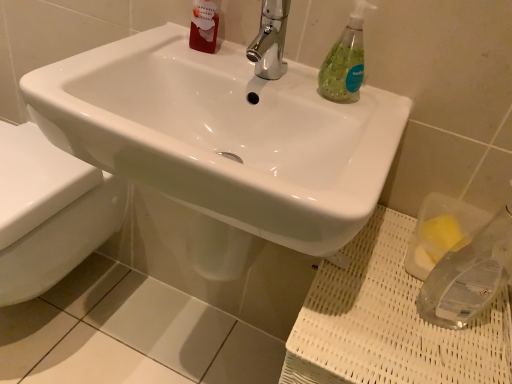
Question: From a real-world perspective, is chrome metallic faucet at upper center positioned over clear plastic sponge at lower right based on gravity?

Choices:
 (A) no
 (B) yes

Answer: (B)

Question: Is chrome metallic faucet at upper center facing towards clear plastic sponge at lower right?

Choices:
 (A) yes
 (B) no

Answer: (B)

Question: Is clear plastic sponge at lower right a part of chrome metallic faucet at upper center?

Choices:
 (A) no
 (B) yes

Answer: (A)

Question: Considering the relative sizes of chrome metallic faucet at upper center and clear plastic sponge at lower right in the image provided, is chrome metallic faucet at upper center shorter than clear plastic sponge at lower right?

Choices:
 (A) no
 (B) yes

Answer: (B)

Question: Is the depth of chrome metallic faucet at upper center less than that of clear plastic sponge at lower right?

Choices:
 (A) yes
 (B) no

Answer: (B)

Question: Considering the positions of point (332, 92) and point (212, 23), is point (332, 92) closer or farther from the camera than point (212, 23)?

Choices:
 (A) closer
 (B) farther

Answer: (A)

Question: From a real-world perspective, is green translucent soap dispenser at upper right physically located above or below translucent red liquid at upper left?

Choices:
 (A) below
 (B) above

Answer: (A)

Question: Is green translucent soap dispenser at upper right taller or shorter than translucent red liquid at upper left?

Choices:
 (A) tall
 (B) short

Answer: (B)

Question: Considering their positions, is green translucent soap dispenser at upper right located in front of or behind translucent red liquid at upper left?

Choices:
 (A) behind
 (B) front

Answer: (B)

Question: Is translucent red liquid at upper left situated inside white glossy toilet at lower left or outside?

Choices:
 (A) inside
 (B) outside

Answer: (B)

Question: Based on their sizes in the image, would you say translucent red liquid at upper left is bigger or smaller than white glossy toilet at lower left?

Choices:
 (A) big
 (B) small

Answer: (B)

Question: Does point (215, 3) appear closer or farther from the camera than point (35, 233)?

Choices:
 (A) closer
 (B) farther

Answer: (A)

Question: From a real-world perspective, is translucent red liquid at upper left above or below white glossy toilet at lower left?

Choices:
 (A) above
 (B) below

Answer: (A)

Question: Is green translucent soap dispenser at upper right wider or thinner than chrome metallic faucet at upper center?

Choices:
 (A) wide
 (B) thin

Answer: (B)

Question: Relative to chrome metallic faucet at upper center, is green translucent soap dispenser at upper right in front or behind?

Choices:
 (A) front
 (B) behind

Answer: (B)